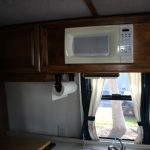
Identify the location of back wall. (41, 105).